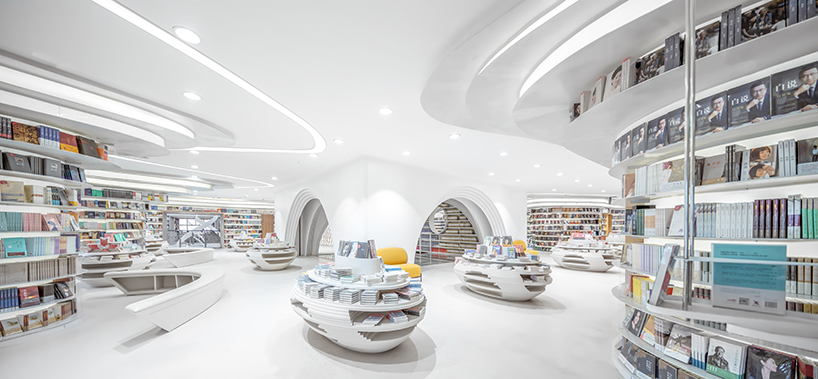
Locate an element on the screen. counter is located at coordinates (204, 280).